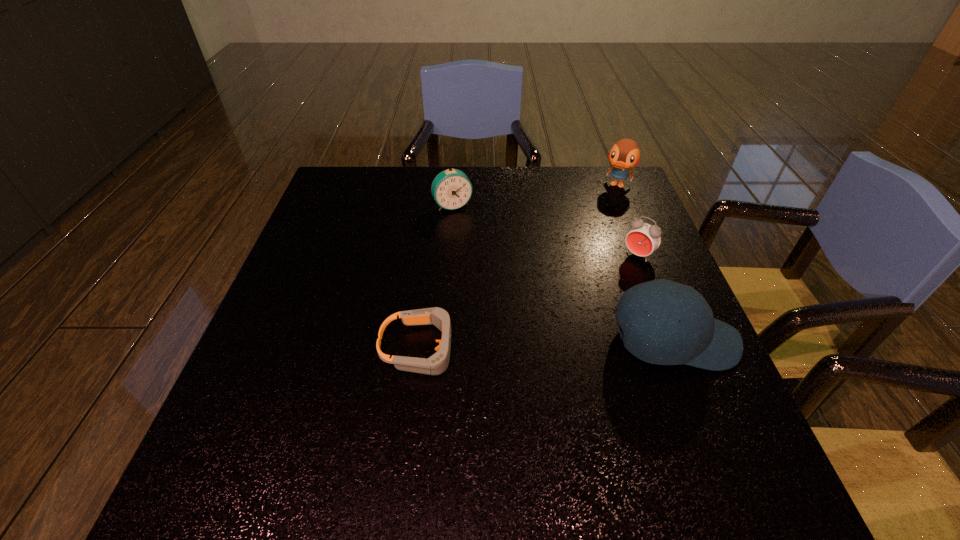
You are a GUI agent. You are given a task and a screenshot of the screen. Output one action in this format:
    pyautogui.click(x=<x>, y=<y>)
    Task: Click on the vacant space that satisfies the following two spatial constraints: 1. on the front side of the baseball cap; 2. on the front-facing side of the left alarm clock
    The width and height of the screenshot is (960, 540).
    Given the screenshot: What is the action you would take?
    pyautogui.click(x=443, y=342)